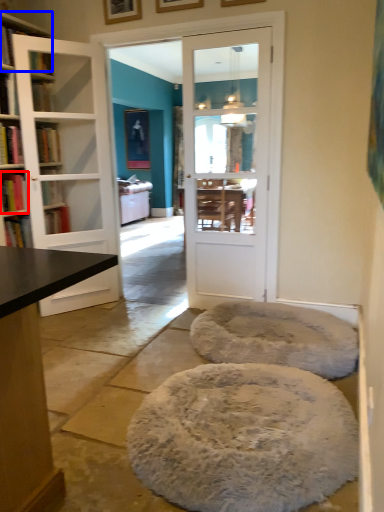
Question: Which point is further to the camera, book (highlighted by a red box) or shelf (highlighted by a blue box)?

Choices:
 (A) book
 (B) shelf

Answer: (A)